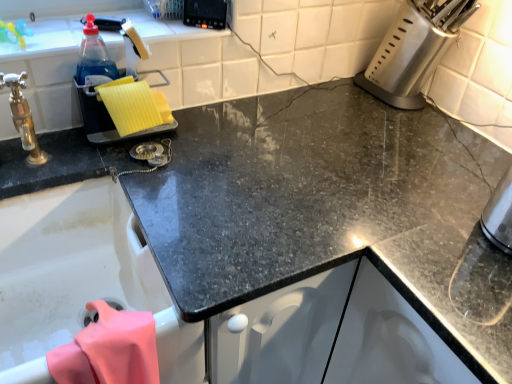
Identify the location of vacant point to the left of satin silver knife block at upper right, the 1th appliance when ordered from right to left. The image size is (512, 384). (327, 100).